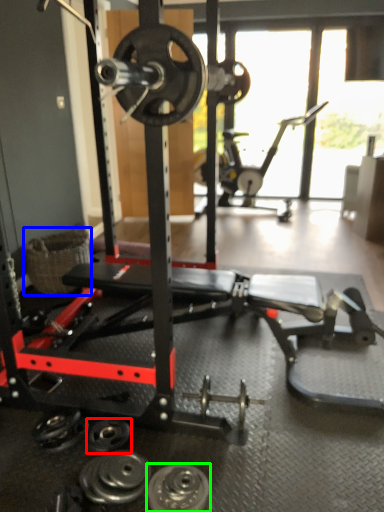
Question: Considering the real-world distances, which object is closest to wheel (highlighted by a red box)? basket (highlighted by a blue box) or wheel (highlighted by a green box).

Choices:
 (A) basket
 (B) wheel

Answer: (B)